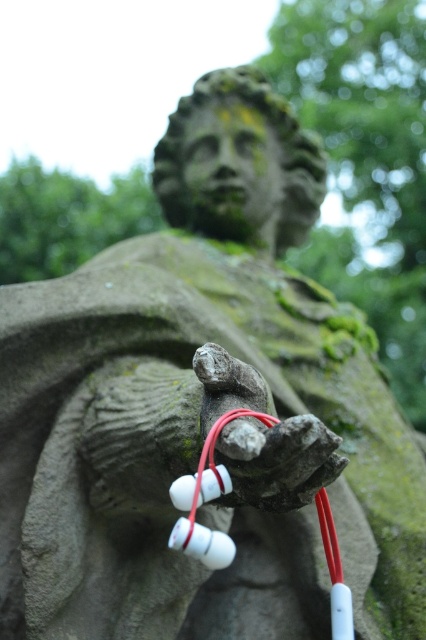
You are an artist trying to sketch the statue. To ensure accuracy, you need to know the position of the smooth stone hand at center relative to the statue. Based on the coordinates provided, is the hand closer to the top or the bottom of the statue?

The smooth stone hand at center is located at coordinates point [281,464]. Since the y coordinate is 0.660, which is closer to 1.0 than 0.0, the hand is closer to the bottom of the statue.

You are a photographer trying to capture the contrast between the ancient statue and modern items in the scene. You notice the smooth stone hand at center and the white plastic earphones at center. Which object is positioned higher up in the image?

The smooth stone hand at center is located above the white plastic earphones at center, so it is positioned higher up in the image.

You are a photographer trying to capture the statue and the earphones in focus. You notice two points of interest marked as point (316, 451) and point (175, 497). Which point should you focus on to ensure both the statue and the earphones are sharp?

You should focus on point (316, 451) because it is closer to the viewer than point (175, 497), ensuring that both the statue and the earphones remain in focus.